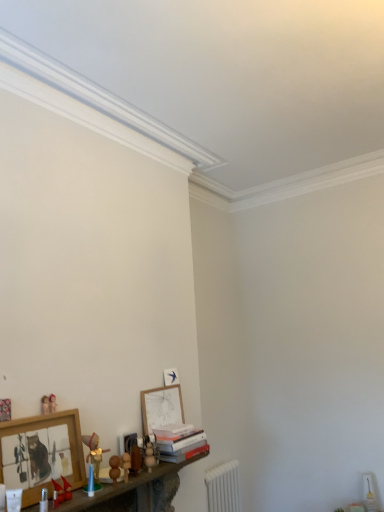
What do you see at coordinates (94, 453) in the screenshot? I see `gold metallic figurine at lower left, positioned as the 3th toy in right-to-left order` at bounding box center [94, 453].

The height and width of the screenshot is (512, 384). What do you see at coordinates (114, 468) in the screenshot? I see `wooden beads at lower left, the 5th toy when ordered from left to right` at bounding box center [114, 468].

What is the approximate width of wooden toy at lower center, the 6th toy from the left?

wooden toy at lower center, the 6th toy from the left, is 6.85 centimeters in width.

The image size is (384, 512). What do you see at coordinates (45, 405) in the screenshot?
I see `matte wooden toy at lower left, the sixth toy positioned from the right` at bounding box center [45, 405].

Locate an element on the screen. This screenshot has width=384, height=512. white plastic radiator at lower right is located at coordinates (223, 488).

Where is `matte wooden figurine at lower left, the 2th toy in the left-to-right sequence`? The image size is (384, 512). matte wooden figurine at lower left, the 2th toy in the left-to-right sequence is located at coordinates (52, 403).

Considering the relative sizes of matte wooden picture frame at center, the 2th picture frame viewed from the front, and matte wooden figurine at lower left, the 2th toy in the left-to-right sequence, in the image provided, is matte wooden picture frame at center, the 2th picture frame viewed from the front, wider than matte wooden figurine at lower left, the 2th toy in the left-to-right sequence,?

Correct, the width of matte wooden picture frame at center, the 2th picture frame viewed from the front, exceeds that of matte wooden figurine at lower left, the 2th toy in the left-to-right sequence.

Does point (175, 403) come closer to viewer compared to point (55, 410)?

No, it is behind (55, 410).

In the image, is matte wooden picture frame at center, which is counted as the 2th picture frame, starting from the left, on the left side or the right side of matte wooden figurine at lower left, acting as the fifth toy starting from the right?

From the image, it's evident that matte wooden picture frame at center, which is counted as the 2th picture frame, starting from the left, is to the right of matte wooden figurine at lower left, acting as the fifth toy starting from the right.

Would you say matte wooden picture frame at center, the 1th picture frame positioned from the right, is inside or outside matte wooden figurine at lower left, acting as the fifth toy starting from the right?

matte wooden picture frame at center, the 1th picture frame positioned from the right, lies outside matte wooden figurine at lower left, acting as the fifth toy starting from the right.

From a real-world perspective, which object stands above the other?

From a 3D spatial view, matte wooden figurine at lower left, the 2th toy in the left-to-right sequence, is above.

Find the location of a particular element. The image size is (384, 512). the 2nd toy in front of the hardcover books at lower center, starting your count from the anchor is located at coordinates (52, 403).

Is hardcover books at lower center far away from matte wooden figurine at lower left, the 2th toy in the left-to-right sequence?

No.

Locate an element on the screen. This screenshot has width=384, height=512. the 2nd toy behind when counting from the wooden beads at lower left, which is the second toy from right to left is located at coordinates (52, 403).

Is wooden beads at lower left, which is the second toy from right to left, directly adjacent to matte wooden figurine at lower left, the 2th toy in the left-to-right sequence?

No, wooden beads at lower left, which is the second toy from right to left, is not making contact with matte wooden figurine at lower left, the 2th toy in the left-to-right sequence.

From the image's perspective, which is below, wooden beads at lower left, the 5th toy when ordered from left to right, or wooden at lower left?

wooden at lower left appears lower in the image.

Which of these two, wooden beads at lower left, which is the second toy from right to left, or wooden at lower left, is wider?

wooden at lower left is wider.

Is wooden beads at lower left, which is the second toy from right to left, positioned beyond the bounds of wooden at lower left?

That's correct, wooden beads at lower left, which is the second toy from right to left, is outside of wooden at lower left.

Considering their positions, is wooden beads at lower left, which is the second toy from right to left, located in front of or behind wooden at lower left?

wooden beads at lower left, which is the second toy from right to left, is positioned farther from the viewer than wooden at lower left.

Which object is positioned more to the left, gold metallic figurine at lower left, positioned as the 3th toy in right-to-left order, or matte wooden toy at lower left, the sixth toy positioned from the right?

matte wooden toy at lower left, the sixth toy positioned from the right, is more to the left.

Can you confirm if gold metallic figurine at lower left, positioned as the 3th toy in right-to-left order, is smaller than matte wooden toy at lower left, which is counted as the first toy, starting from the left?

Incorrect, gold metallic figurine at lower left, positioned as the 3th toy in right-to-left order, is not smaller in size than matte wooden toy at lower left, which is counted as the first toy, starting from the left.

From a real-world perspective, is gold metallic figurine at lower left, positioned as the 3th toy in right-to-left order, located higher than matte wooden toy at lower left, which is counted as the first toy, starting from the left?

Actually, gold metallic figurine at lower left, positioned as the 3th toy in right-to-left order, is physically below matte wooden toy at lower left, which is counted as the first toy, starting from the left, in the real world.

From the image's perspective, is matte wooden figurine at lower left, the 2th toy in the left-to-right sequence, located above or below wooden framed picture at lower left, positioned as the first picture frame in front-to-back order?

From the image's perspective, matte wooden figurine at lower left, the 2th toy in the left-to-right sequence, appears above wooden framed picture at lower left, positioned as the first picture frame in front-to-back order.

From a real-world perspective, which is physically below, matte wooden figurine at lower left, the 2th toy in the left-to-right sequence, or wooden framed picture at lower left, which ranks as the second picture frame in back-to-front order?

wooden framed picture at lower left, which ranks as the second picture frame in back-to-front order, is physically lower.

Is matte wooden figurine at lower left, the 2th toy in the left-to-right sequence, placed right next to wooden framed picture at lower left, which is the first picture frame from left to right?

There is a gap between matte wooden figurine at lower left, the 2th toy in the left-to-right sequence, and wooden framed picture at lower left, which is the first picture frame from left to right.

In order to click on toy that is the 2nd one above the wooden framed picture at lower left, which is the first picture frame from left to right (from a real-world perspective) in this screenshot , I will do `click(52, 403)`.

From the picture: Is matte red toy boat at lower left, arranged as the fourth toy when viewed from the right, not close to gold metallic figurine at lower left, placed as the 4th toy when sorted from left to right?

No, matte red toy boat at lower left, arranged as the fourth toy when viewed from the right, is in close proximity to gold metallic figurine at lower left, placed as the 4th toy when sorted from left to right.

Which object is closer to the camera taking this photo, matte red toy boat at lower left, arranged as the fourth toy when viewed from the right, or gold metallic figurine at lower left, placed as the 4th toy when sorted from left to right?

matte red toy boat at lower left, arranged as the fourth toy when viewed from the right, is more forward.

Is matte red toy boat at lower left, arranged as the fourth toy when viewed from the right, positioned with its back to gold metallic figurine at lower left, positioned as the 3th toy in right-to-left order?

No, gold metallic figurine at lower left, positioned as the 3th toy in right-to-left order, is not at the back of matte red toy boat at lower left, arranged as the fourth toy when viewed from the right.

Measure the distance between matte red toy boat at lower left, which is the 3th toy from left to right, and gold metallic figurine at lower left, placed as the 4th toy when sorted from left to right.

matte red toy boat at lower left, which is the 3th toy from left to right, and gold metallic figurine at lower left, placed as the 4th toy when sorted from left to right, are 7.35 inches apart.

In order to click on picture frame that appears behind the matte wooden figurine at lower left, acting as the fifth toy starting from the right in this screenshot , I will do `click(161, 407)`.

Find the location of a particular element. book below the matte wooden figurine at lower left, the 2th toy in the left-to-right sequence (from the image's perspective) is located at coordinates (180, 442).

When comparing their distances from white plastic radiator at lower right, does wooden toy at lower center, the 1th toy positioned from the right, or hardcover books at lower center seem further?

wooden toy at lower center, the 1th toy positioned from the right, is further to white plastic radiator at lower right.

Considering their positions, is matte wooden toy at lower left, the sixth toy positioned from the right, positioned closer to matte wooden picture frame at center, the 1th picture frame positioned from the right, than gold metallic figurine at lower left, placed as the 4th toy when sorted from left to right?

The object closer to matte wooden picture frame at center, the 1th picture frame positioned from the right, is gold metallic figurine at lower left, placed as the 4th toy when sorted from left to right.

Based on their spatial positions, is matte wooden picture frame at center, which is counted as the 2th picture frame, starting from the left, or wooden beads at lower left, the 5th toy when ordered from left to right, further from white plastic radiator at lower right?

wooden beads at lower left, the 5th toy when ordered from left to right, lies further to white plastic radiator at lower right than the other object.

Considering their positions, is wooden beads at lower left, the 5th toy when ordered from left to right, positioned closer to white plastic radiator at lower right than wooden toy at lower center, the 6th toy from the left?

The object closer to white plastic radiator at lower right is wooden toy at lower center, the 6th toy from the left.

When comparing their distances from wooden beads at lower left, which is the second toy from right to left, does matte red toy boat at lower left, arranged as the fourth toy when viewed from the right, or matte wooden picture frame at center, marked as the first picture frame in a back-to-front arrangement, seem closer?

Among the two, matte red toy boat at lower left, arranged as the fourth toy when viewed from the right, is located nearer to wooden beads at lower left, which is the second toy from right to left.

Looking at the image, which one is located further to matte wooden figurine at lower left, the 2th toy in the left-to-right sequence, white plastic radiator at lower right or wooden toy at lower center, the 1th toy positioned from the right?

white plastic radiator at lower right is further to matte wooden figurine at lower left, the 2th toy in the left-to-right sequence.

Estimate the real-world distances between objects in this image. Which object is closer to white plastic radiator at lower right, matte wooden toy at lower left, the sixth toy positioned from the right, or wooden framed picture at lower left, positioned as the first picture frame in front-to-back order?

The object closer to white plastic radiator at lower right is wooden framed picture at lower left, positioned as the first picture frame in front-to-back order.

From the image, which object appears to be farther from wooden toy at lower center, the 1th toy positioned from the right, matte wooden toy at lower left, which is counted as the first toy, starting from the left, or wooden at lower left?

matte wooden toy at lower left, which is counted as the first toy, starting from the left, is further to wooden toy at lower center, the 1th toy positioned from the right.

This screenshot has width=384, height=512. I want to click on book positioned between wooden framed picture at lower left, positioned as the first picture frame in front-to-back order, and white plastic radiator at lower right from near to far, so click(180, 442).

Locate an element on the screen. This screenshot has width=384, height=512. toy between wooden at lower left and gold metallic figurine at lower left, placed as the 4th toy when sorted from left to right, along the z-axis is located at coordinates (61, 492).

The width and height of the screenshot is (384, 512). I want to click on book between matte wooden picture frame at center, the 1th picture frame positioned from the right, and white plastic radiator at lower right vertically, so click(x=180, y=442).

At what (x,y) coordinates should I click in order to perform the action: click on book between gold metallic figurine at lower left, positioned as the 3th toy in right-to-left order, and white plastic radiator at lower right from front to back. Please return your answer as a coordinate pair (x, y). The image size is (384, 512). Looking at the image, I should click on click(x=180, y=442).